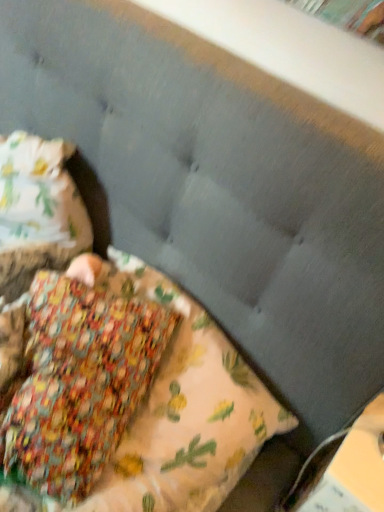
Question: Is hardcover book at lower right to the left or to the right of floral fabric pillow at center in the image?

Choices:
 (A) left
 (B) right

Answer: (B)

Question: Is hardcover book at lower right bigger or smaller than floral fabric pillow at center?

Choices:
 (A) small
 (B) big

Answer: (A)

Question: From their relative heights in the image, would you say hardcover book at lower right is taller or shorter than floral fabric pillow at center?

Choices:
 (A) tall
 (B) short

Answer: (A)

Question: Choose the correct answer: Is floral fabric pillow at center inside hardcover book at lower right or outside it?

Choices:
 (A) outside
 (B) inside

Answer: (A)

Question: From a real-world perspective, is floral fabric pillow at center above or below hardcover book at lower right?

Choices:
 (A) below
 (B) above

Answer: (B)

Question: In terms of height, does floral fabric pillow at center look taller or shorter compared to hardcover book at lower right?

Choices:
 (A) short
 (B) tall

Answer: (A)

Question: Considering their positions, is floral fabric pillow at center located in front of or behind hardcover book at lower right?

Choices:
 (A) front
 (B) behind

Answer: (A)